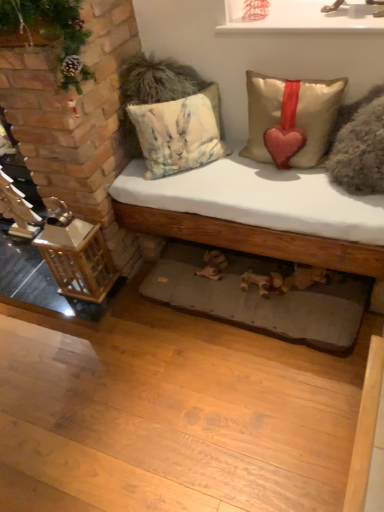
Locate an element on the screen. Image resolution: width=384 pixels, height=512 pixels. free space between satin gold pillow with red heart at upper center, the second pillow from the right, and satin beige cushion at right, which is the third pillow from left to right is located at coordinates click(x=282, y=185).